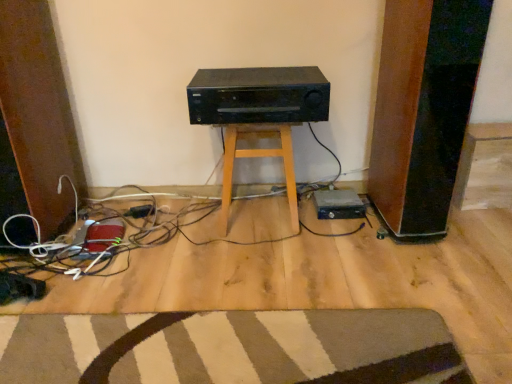
Find the location of a particular element. This screenshot has height=384, width=512. free space to the back side of striped carpet at lower center is located at coordinates (225, 266).